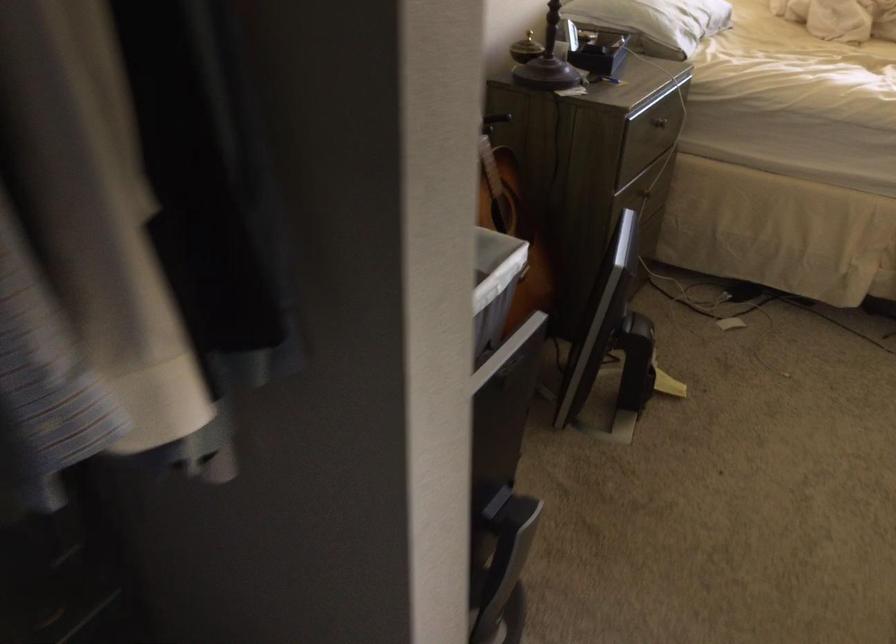
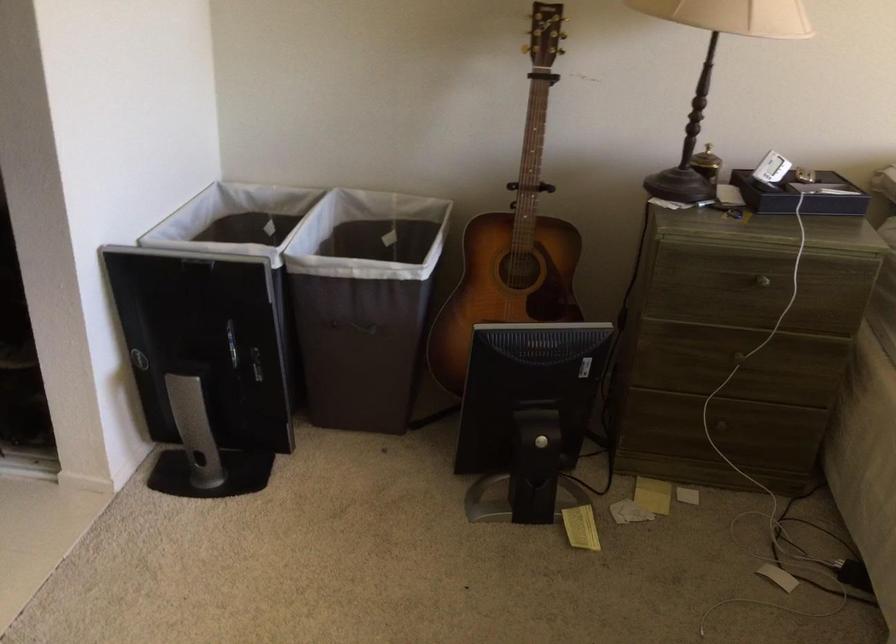
Locate, in the second image, the point that corresponds to (x=625, y=328) in the first image.

(528, 415)